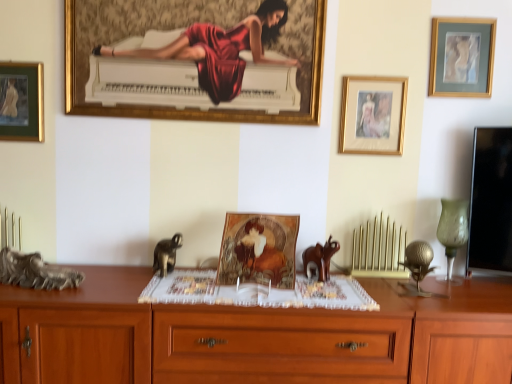
Question: Should I look upward or downward to see gold-framed picture at center-right, which ranks as the second picture frame in right-to-left order?

Choices:
 (A) down
 (B) up

Answer: (B)

Question: From the image's perspective, is wooden drawer at center under green glass vase at right?

Choices:
 (A) yes
 (B) no

Answer: (A)

Question: Is green glass vase at right completely or partially inside wooden drawer at center?

Choices:
 (A) no
 (B) yes

Answer: (A)

Question: Are wooden drawer at center and green glass vase at right making contact?

Choices:
 (A) yes
 (B) no

Answer: (B)

Question: Can you confirm if wooden drawer at center is bigger than green glass vase at right?

Choices:
 (A) yes
 (B) no

Answer: (A)

Question: Considering the relative positions of wooden drawer at center and green glass vase at right in the image provided, is wooden drawer at center to the right of green glass vase at right from the viewer's perspective?

Choices:
 (A) no
 (B) yes

Answer: (A)

Question: From a real-world perspective, is wooden drawer at center on green glass vase at right?

Choices:
 (A) yes
 (B) no

Answer: (B)

Question: Does gold-framed artwork at upper right, which is the 4th picture frame in left-to-right order, have a greater height compared to wooden drawer at center?

Choices:
 (A) yes
 (B) no

Answer: (B)

Question: From a real-world perspective, is gold-framed artwork at upper right, which is the 4th picture frame in left-to-right order, beneath wooden drawer at center?

Choices:
 (A) no
 (B) yes

Answer: (A)

Question: Can you confirm if gold-framed artwork at upper right, positioned as the first picture frame in right-to-left order, is smaller than wooden drawer at center?

Choices:
 (A) yes
 (B) no

Answer: (A)

Question: Is gold-framed artwork at upper right, which is the 4th picture frame in left-to-right order, next to wooden drawer at center?

Choices:
 (A) yes
 (B) no

Answer: (B)

Question: Is the depth of gold-framed artwork at upper right, positioned as the first picture frame in right-to-left order, greater than that of wooden drawer at center?

Choices:
 (A) yes
 (B) no

Answer: (A)

Question: Is gold-framed artwork at upper right, positioned as the first picture frame in right-to-left order, closer to the viewer compared to wooden drawer at center?

Choices:
 (A) no
 (B) yes

Answer: (A)

Question: From a real-world perspective, is rustic wood sculpture at left, marked as the first animal in a left-to-right arrangement, on top of gold-framed artwork at upper right, positioned as the first picture frame in right-to-left order?

Choices:
 (A) yes
 (B) no

Answer: (B)